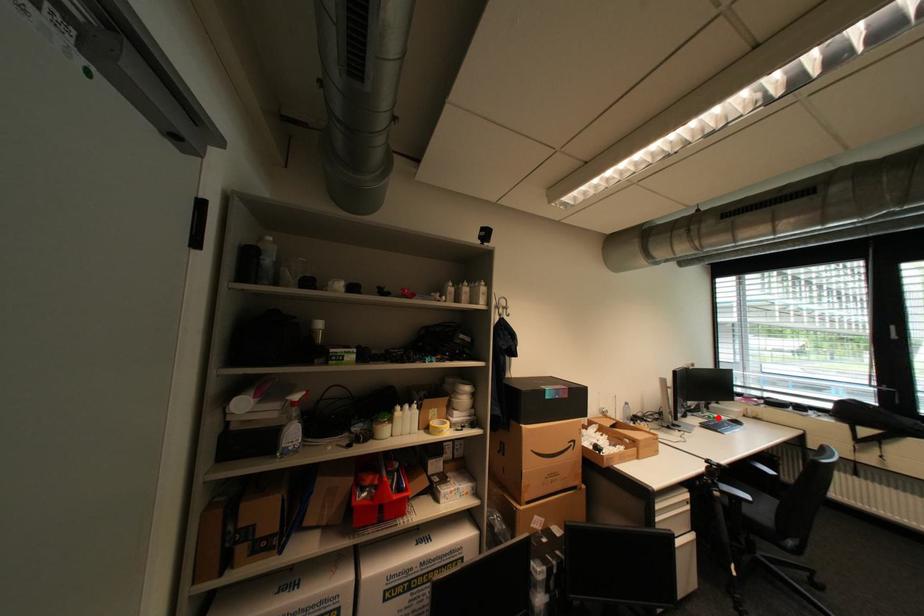
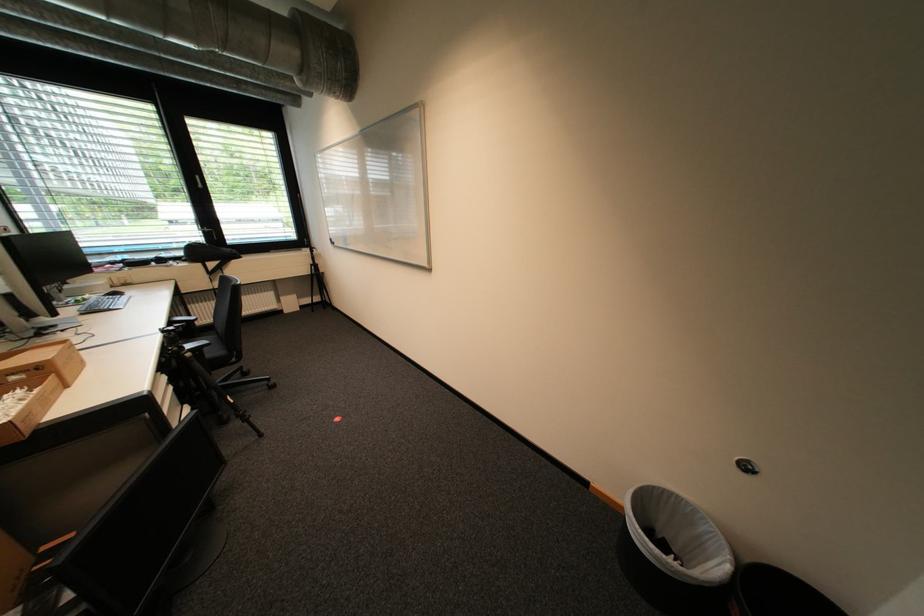
Find the pixel in the second image that matches the highlighted location in the first image.

(86, 302)